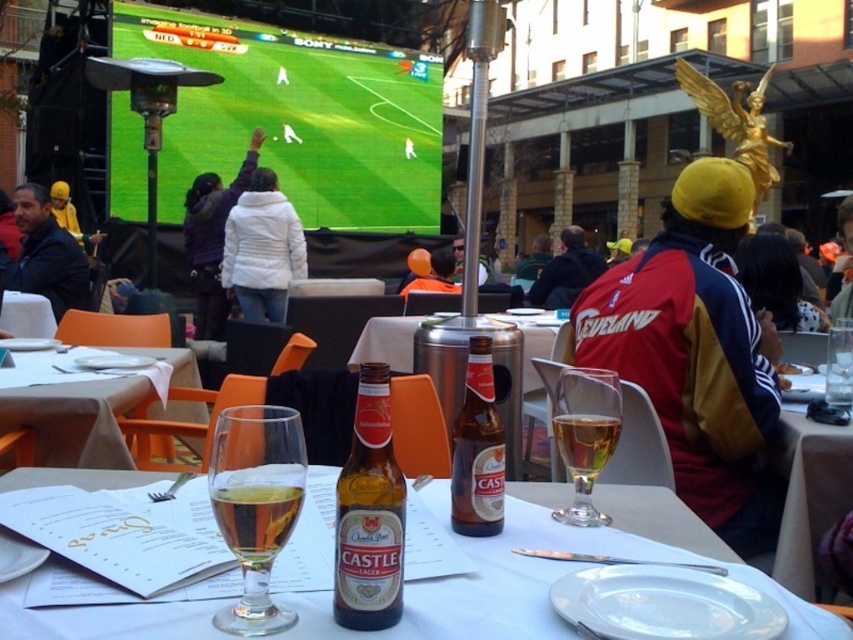
Does clear glass at center appear under metallic silver table at center?

Yes.

Between clear glass at center and metallic silver table at center, which one has less height?

With less height is clear glass at center.

Between point (65, 628) and point (392, 346), which one is positioned behind?

The point (392, 346) is behind.

Locate an element on the screen. clear glass at center is located at coordinates (489, 582).

Which is behind, point (48, 209) or point (437, 275)?

The point (437, 275) is more distant.

I want to click on matte black jacket at left, so click(x=45, y=253).

Is point (621, 326) farther from camera compared to point (363, 353)?

No, it is in front of (363, 353).

Is red and blue jacket at center to the left of metallic silver table at center from the viewer's perspective?

No, red and blue jacket at center is not to the left of metallic silver table at center.

Between point (727, 410) and point (369, 336), which one is positioned behind?

The point (369, 336) is more distant.

At what (x,y) coordinates should I click in order to perform the action: click on red and blue jacket at center. Please return your answer as a coordinate pair (x, y). This screenshot has height=640, width=853. Looking at the image, I should click on (695, 352).